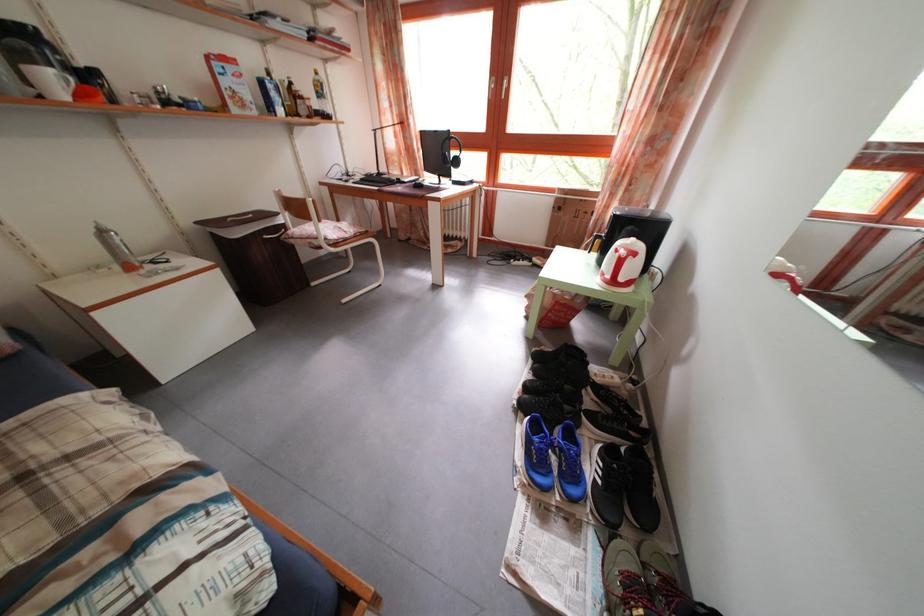
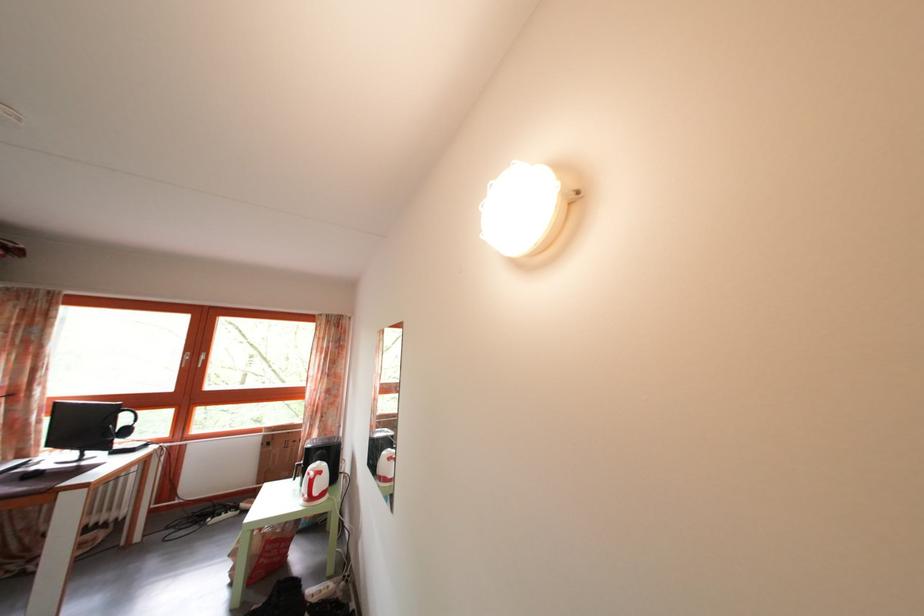
The point at (614, 215) is marked in the first image. Where is the corresponding point in the second image?

(317, 442)